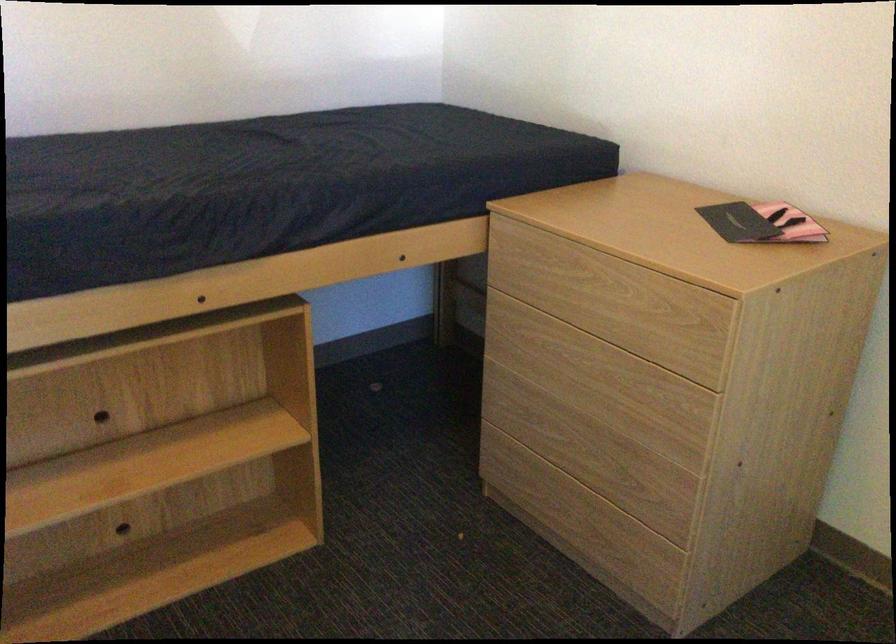
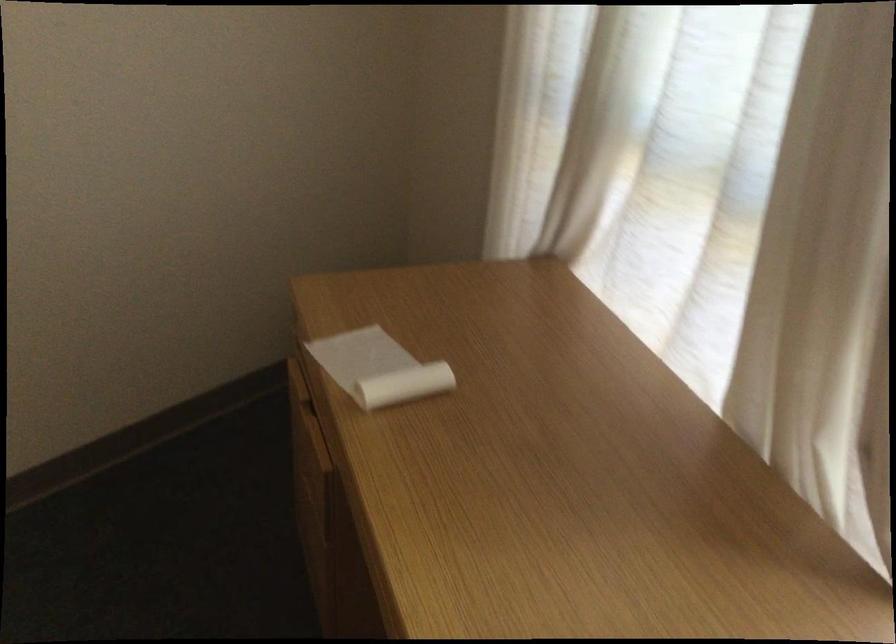
The first image is from the beginning of the video and the second image is from the end. How did the camera likely rotate when shooting the video?

The camera rotated toward right-down.